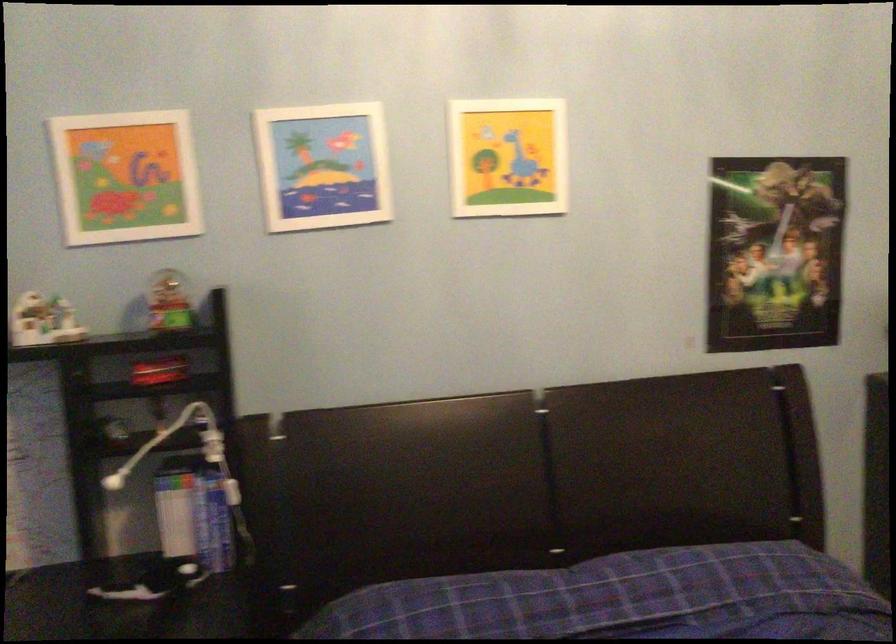
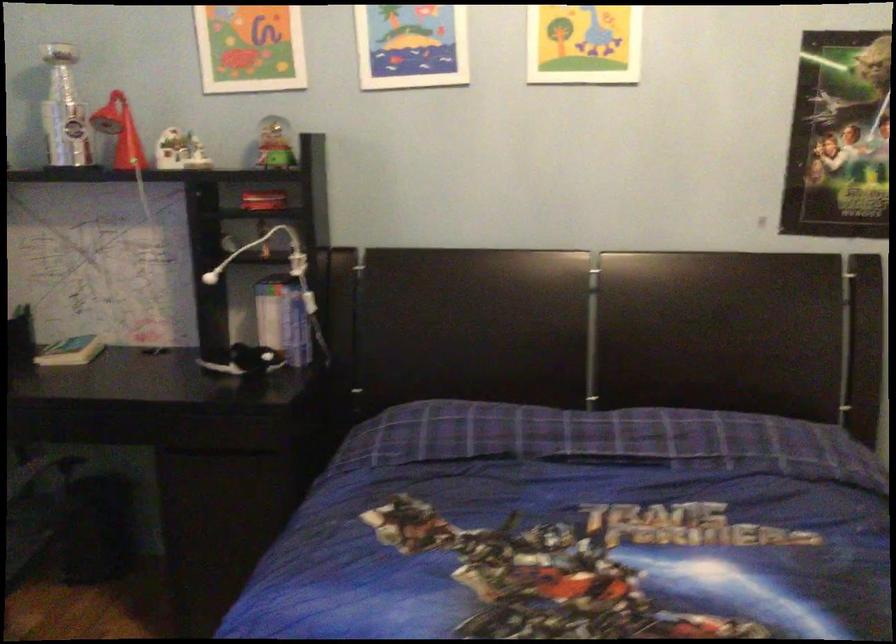
Question: Based on the continuous images, in which direction is the camera rotating? Reply with the corresponding letter.

Choices:
 (A) Left
 (B) Right
 (C) Up
 (D) Down

Answer: (A)